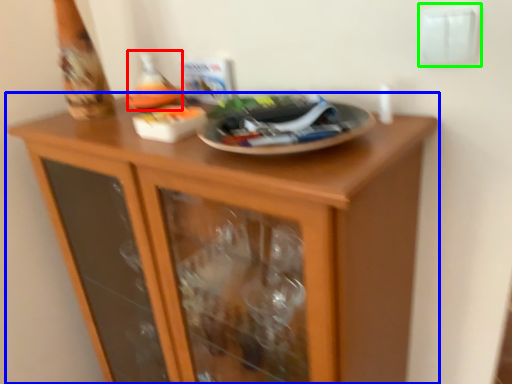
Question: Which object is positioned closest to wine bottle (highlighted by a red box)? Select from cupboard (highlighted by a blue box) and electric outlet (highlighted by a green box).

Choices:
 (A) cupboard
 (B) electric outlet

Answer: (A)